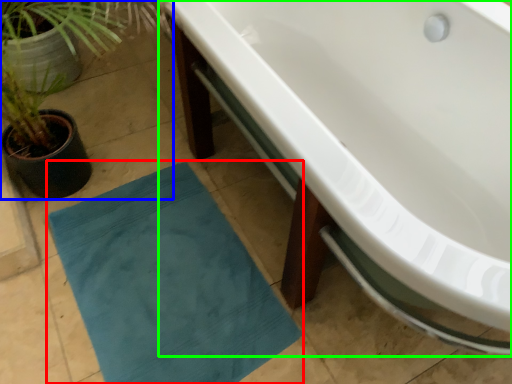
Question: Based on their relative distances, which object is nearer to bath mat (highlighted by a red box)? Choose from houseplant (highlighted by a blue box) and bathtub (highlighted by a green box).

Choices:
 (A) houseplant
 (B) bathtub

Answer: (A)